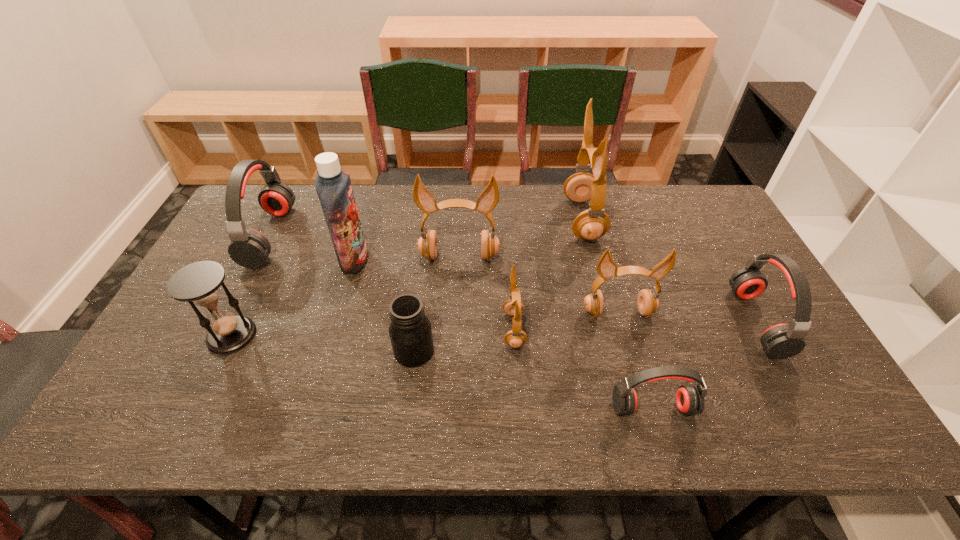
The height and width of the screenshot is (540, 960). I want to click on blank region between the second nearest red earphone and the black hourglass, so tap(494, 328).

The height and width of the screenshot is (540, 960). What are the coordinates of `blank region between the smallest red earphone and the third smallest brown earphone` in the screenshot? It's located at (556, 332).

Locate an element on the screen. vacant space that's between the smallest brown earphone and the eighth object from right to left is located at coordinates (434, 295).

At what (x,y) coordinates should I click in order to perform the action: click on vacant space that is in between the eighth shortest object and the biggest brown earphone. Please return your answer as a coordinate pair (x, y). The image size is (960, 540). Looking at the image, I should click on (521, 239).

This screenshot has height=540, width=960. I want to click on unoccupied area between the second red earphone from right to left and the jar, so click(x=534, y=379).

What are the coordinates of `free point between the black hourglass and the shampoo` in the screenshot? It's located at (293, 298).

Find the location of a particular element. This screenshot has width=960, height=540. blank region between the biggest brown earphone and the smallest brown earphone is located at coordinates (548, 274).

Identify which object is the seventh nearest to the leftmost earphone. Please provide its 2D coordinates. Your answer should be formatted as a tuple, i.e. [(x, y)], where the tuple contains the x and y coordinates of a point satisfying the conditions above.

[(591, 224)]

Where is `object that ranks as the seventh closest to the smallest brown earphone`? The image size is (960, 540). object that ranks as the seventh closest to the smallest brown earphone is located at coordinates (781, 341).

Locate which earphone ranks fifth in proximity to the third smallest brown earphone. Please provide its 2D coordinates. Your answer should be formatted as a tuple, i.e. [(x, y)], where the tuple contains the x and y coordinates of a point satisfying the conditions above.

[(689, 398)]